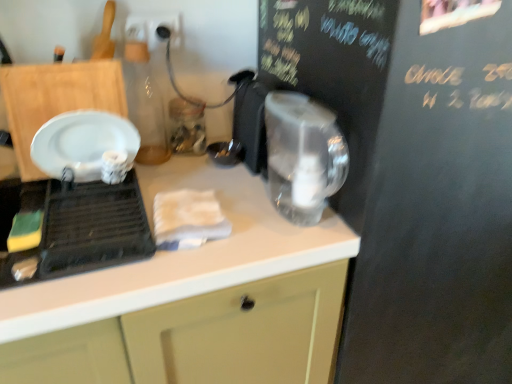
Identify the location of black chalkboard at upper right. (413, 179).

Find the location of a particular element. The width and height of the screenshot is (512, 384). black chalkboard at upper right is located at coordinates (413, 179).

Could you tell me if white glossy plate at left is facing white matte countertop at center?

No, white glossy plate at left is not turned towards white matte countertop at center.

Can you tell me how much white glossy plate at left and white matte countertop at center differ in facing direction?

The facing directions of white glossy plate at left and white matte countertop at center are 89.2 degrees apart.

Does point (112, 262) lie behind point (91, 287)?

Yes, point (112, 262) is farther from viewer.

Is white matte countertop at center a part of white glossy plate at left?

No, white matte countertop at center is not surrounded by white glossy plate at left.

Who is bigger, white matte countertop at center or black chalkboard at upper right?

black chalkboard at upper right is bigger.

Which object is further away from the camera, white matte countertop at center or black chalkboard at upper right?

black chalkboard at upper right.

From the image's perspective, relative to black chalkboard at upper right, is white matte countertop at center above or below?

white matte countertop at center is below black chalkboard at upper right.

Which object is positioned more to the left, white matte countertop at center or black chalkboard at upper right?

Positioned to the left is white matte countertop at center.

In the scene shown: What's the angular difference between white glossy plate at left and black chalkboard at upper right's facing directions?

The angle between the facing direction of white glossy plate at left and the facing direction of black chalkboard at upper right is 90 degrees.

Is point (82, 265) farther from viewer compared to point (409, 148)?

That is False.

How much distance is there between white glossy plate at left and black chalkboard at upper right?

white glossy plate at left and black chalkboard at upper right are 22.58 inches apart from each other.

Is white glossy plate at left next to black chalkboard at upper right?

white glossy plate at left and black chalkboard at upper right are not in contact.

Measure the distance between transparent plastic kettle at center and black chalkboard at upper right.

transparent plastic kettle at center is 7.76 inches away from black chalkboard at upper right.

From a real-world perspective, between transparent plastic kettle at center and black chalkboard at upper right, who is vertically higher?

In real-world perspective, transparent plastic kettle at center is above.

You are a GUI agent. You are given a task and a screenshot of the screen. Output one action in this format:
    pyautogui.click(x=<x>, y=<y>)
    Task: Click on the bulletin board that is under the transparent plastic kettle at center (from a real-world perspective)
    The width and height of the screenshot is (512, 384).
    Given the screenshot: What is the action you would take?
    pyautogui.click(x=413, y=179)

Looking at this image, could you tell me if transparent plastic kettle at center is facing black chalkboard at upper right?

No, transparent plastic kettle at center is not aimed at black chalkboard at upper right.

Based on the photo, from the image's perspective, which is above, black chalkboard at upper right or transparent plastic kettle at center?

transparent plastic kettle at center.

Does black chalkboard at upper right have a larger size compared to transparent plastic kettle at center?

Yes.

Does point (466, 155) lie in front of point (278, 111)?

No, (466, 155) is behind (278, 111).

In terms of width, does black chalkboard at upper right look wider or thinner when compared to transparent plastic kettle at center?

Considering their sizes, black chalkboard at upper right looks broader than transparent plastic kettle at center.

Looking at this image, from the image's perspective, who appears lower, white glossy plate at left or transparent plastic kettle at center?

From the image's view, white glossy plate at left is below.

Where is `appliance behind the white glossy plate at left`? The width and height of the screenshot is (512, 384). appliance behind the white glossy plate at left is located at coordinates (303, 156).

Is white glossy plate at left completely or partially outside of transparent plastic kettle at center?

Yes, white glossy plate at left is outside of transparent plastic kettle at center.

Is the surface of white glossy plate at left in direct contact with transparent plastic kettle at center?

white glossy plate at left and transparent plastic kettle at center are not in contact.

From a real-world perspective, which object rests below the other?

white matte countertop at center, from a real-world perspective.

In terms of size, does black chalkboard at upper right appear bigger or smaller than white matte countertop at center?

In the image, black chalkboard at upper right appears to be larger than white matte countertop at center.

Identify the location of bulletin board above the white matte countertop at center (from the image's perspective). The image size is (512, 384). (413, 179).

Where is `countertop below the white glossy plate at left (from the image's perspective)`? countertop below the white glossy plate at left (from the image's perspective) is located at coordinates (182, 255).

At what (x,y) coordinates should I click in order to perform the action: click on bulletin board above the white matte countertop at center (from the image's perspective). Please return your answer as a coordinate pair (x, y). Looking at the image, I should click on (413, 179).

From the image, which object appears to be nearer to white glossy plate at left, white matte countertop at center or black chalkboard at upper right?

The object closer to white glossy plate at left is white matte countertop at center.

From the image, which object appears to be farther from black chalkboard at upper right, transparent plastic kettle at center or white glossy plate at left?

Based on the image, white glossy plate at left appears to be further to black chalkboard at upper right.

Looking at this image, from the image, which object appears to be farther from white matte countertop at center, black chalkboard at upper right or white glossy plate at left?

black chalkboard at upper right lies further to white matte countertop at center than the other object.

From the image, which object appears to be farther from transparent plastic kettle at center, black chalkboard at upper right or white glossy plate at left?

Among the two, white glossy plate at left is located further to transparent plastic kettle at center.

Based on their spatial positions, is white glossy plate at left or white matte countertop at center closer to transparent plastic kettle at center?

white matte countertop at center is positioned closer to the anchor transparent plastic kettle at center.

Which object lies nearer to the anchor point transparent plastic kettle at center, black chalkboard at upper right or white matte countertop at center?

white matte countertop at center.

Which object lies further to the anchor point white glossy plate at left, black chalkboard at upper right or transparent plastic kettle at center?

black chalkboard at upper right is positioned further to the anchor white glossy plate at left.

Based on their spatial positions, is black chalkboard at upper right or transparent plastic kettle at center further from white matte countertop at center?

The object further to white matte countertop at center is black chalkboard at upper right.

Where is `appliance between white glossy plate at left and black chalkboard at upper right in the horizontal direction`? appliance between white glossy plate at left and black chalkboard at upper right in the horizontal direction is located at coordinates (303, 156).

The height and width of the screenshot is (384, 512). Identify the location of countertop between white glossy plate at left and transparent plastic kettle at center in the horizontal direction. (182, 255).

Where is `countertop between white glossy plate at left and black chalkboard at upper right in the horizontal direction`? countertop between white glossy plate at left and black chalkboard at upper right in the horizontal direction is located at coordinates (182, 255).

The width and height of the screenshot is (512, 384). Find the location of `appliance between white matte countertop at center and black chalkboard at upper right in the horizontal direction`. appliance between white matte countertop at center and black chalkboard at upper right in the horizontal direction is located at coordinates (303, 156).